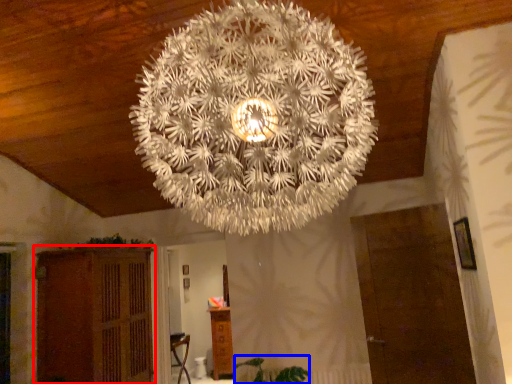
Question: Which of the following is the closest to the observer, furniture (highlighted by a red box) or plant (highlighted by a blue box)?

Choices:
 (A) furniture
 (B) plant

Answer: (A)